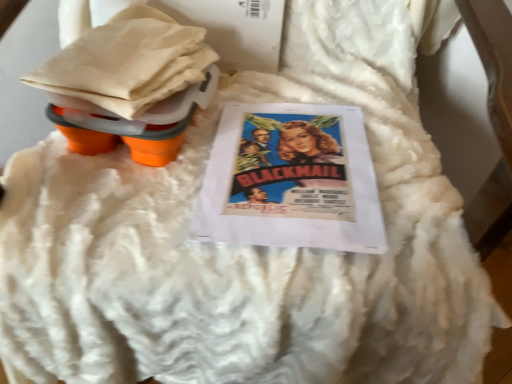
Question: Considering the positions of point (234, 112) and point (113, 132), is point (234, 112) closer or farther from the camera than point (113, 132)?

Choices:
 (A) closer
 (B) farther

Answer: (B)

Question: From the image's perspective, is matte paper movie poster at center positioned above or below orange rubberized cups at upper left?

Choices:
 (A) above
 (B) below

Answer: (B)

Question: In the image, is matte paper movie poster at center on the left side or the right side of orange rubberized cups at upper left?

Choices:
 (A) right
 (B) left

Answer: (A)

Question: From a real-world perspective, relative to matte paper movie poster at center, is orange rubberized cups at upper left vertically above or below?

Choices:
 (A) below
 (B) above

Answer: (B)

Question: Looking at their shapes, would you say orange rubberized cups at upper left is wider or thinner than matte paper movie poster at center?

Choices:
 (A) wide
 (B) thin

Answer: (B)

Question: Considering the positions of point (159, 41) and point (283, 210), is point (159, 41) closer or farther from the camera than point (283, 210)?

Choices:
 (A) farther
 (B) closer

Answer: (A)

Question: In the image, is orange rubberized cups at upper left positioned in front of or behind matte paper movie poster at center?

Choices:
 (A) front
 (B) behind

Answer: (A)